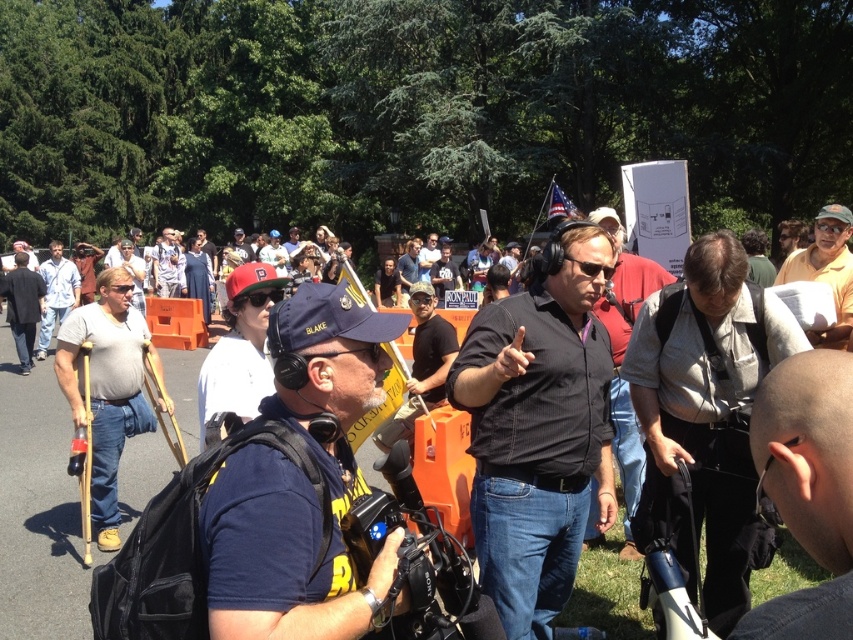
You are a photographer trying to capture a clear shot of the black striped shirt at center and the light brown wood crutches at left. Based on their positions, which object should you focus on first to ensure it appears sharp in your photo?

The black striped shirt at center should be focused on first because it is closer to the viewer than the light brown wood crutches at left, so focusing on the closer object ensures depth of field captures both effectively.

You are a photographer trying to capture a clear shot of both the light brown leather jacket at left and the matte black shirt at center. Based on their heights, which one will appear larger in your photo?

The light brown leather jacket at left is much taller than the matte black shirt at center, so it will appear larger in the photo.